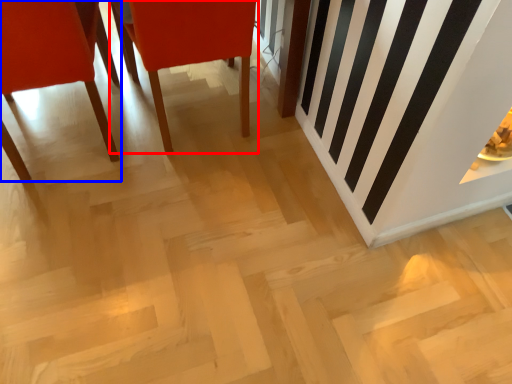
Question: Which object appears farthest to the camera in this image, chair (highlighted by a red box) or chair (highlighted by a blue box)?

Choices:
 (A) chair
 (B) chair

Answer: (A)